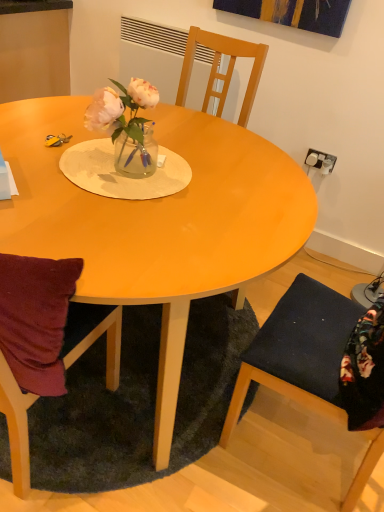
Question: Is dark green shaggy rug at lower center to the right of translucent glass vase at center from the viewer's perspective?

Choices:
 (A) no
 (B) yes

Answer: (A)

Question: Can you confirm if dark green shaggy rug at lower center is positioned to the left of translucent glass vase at center?

Choices:
 (A) yes
 (B) no

Answer: (A)

Question: Does dark green shaggy rug at lower center have a larger size compared to translucent glass vase at center?

Choices:
 (A) no
 (B) yes

Answer: (B)

Question: Is dark green shaggy rug at lower center not inside translucent glass vase at center?

Choices:
 (A) yes
 (B) no

Answer: (A)

Question: From a real-world perspective, is dark green shaggy rug at lower center over translucent glass vase at center?

Choices:
 (A) yes
 (B) no

Answer: (B)

Question: Is dark blue fabric chair at lower right wider or thinner than dark green shaggy rug at lower center?

Choices:
 (A) thin
 (B) wide

Answer: (A)

Question: From a real-world perspective, is dark blue fabric chair at lower right above or below dark green shaggy rug at lower center?

Choices:
 (A) above
 (B) below

Answer: (A)

Question: Considering their positions, is dark blue fabric chair at lower right located in front of or behind dark green shaggy rug at lower center?

Choices:
 (A) behind
 (B) front

Answer: (B)

Question: Choose the correct answer: Is dark blue fabric chair at lower right inside dark green shaggy rug at lower center or outside it?

Choices:
 (A) inside
 (B) outside

Answer: (B)

Question: Is matte wood table at center taller or shorter than translucent glass vase at center?

Choices:
 (A) short
 (B) tall

Answer: (B)

Question: Considering the positions of matte wood table at center and translucent glass vase at center in the image, is matte wood table at center wider or thinner than translucent glass vase at center?

Choices:
 (A) thin
 (B) wide

Answer: (B)

Question: Is matte wood table at center inside the boundaries of translucent glass vase at center, or outside?

Choices:
 (A) inside
 (B) outside

Answer: (B)

Question: Considering the relative positions of matte wood table at center and translucent glass vase at center in the image provided, is matte wood table at center to the left or to the right of translucent glass vase at center?

Choices:
 (A) left
 (B) right

Answer: (A)

Question: Relative to matte wood table at center, is dark blue fabric chair at lower right in front or behind?

Choices:
 (A) front
 (B) behind

Answer: (A)

Question: Considering the relative positions of dark blue fabric chair at lower right and matte wood table at center in the image provided, is dark blue fabric chair at lower right to the left or to the right of matte wood table at center?

Choices:
 (A) right
 (B) left

Answer: (A)